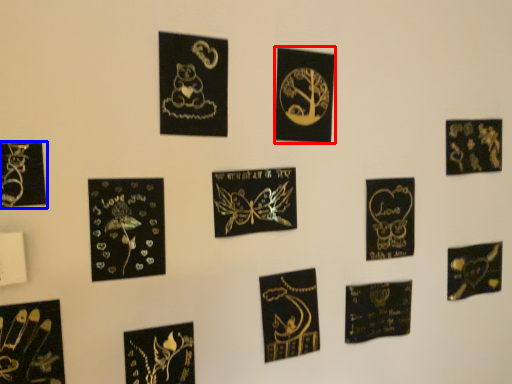
Question: Which point is closer to the camera, picture frame (highlighted by a red box) or picture frame (highlighted by a blue box)?

Choices:
 (A) picture frame
 (B) picture frame

Answer: (B)